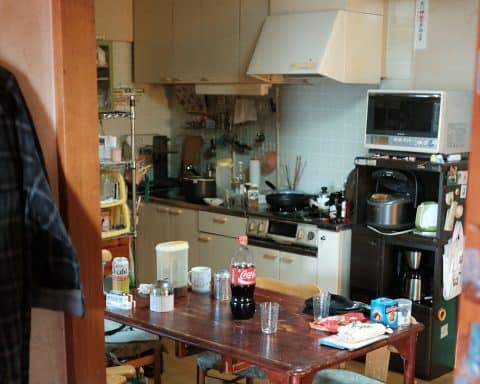
The image size is (480, 384). I want to click on floor, so click(174, 370).